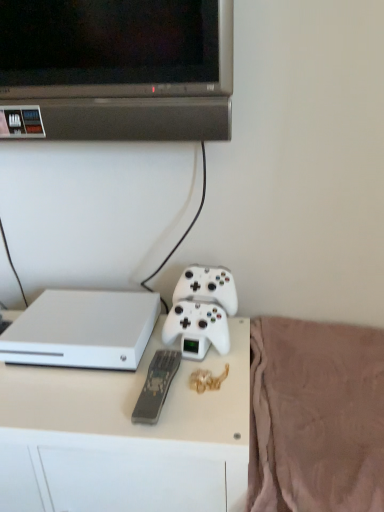
I want to click on vacant space in between white matte gaming console at lower left and gray matte remote at center, so click(87, 391).